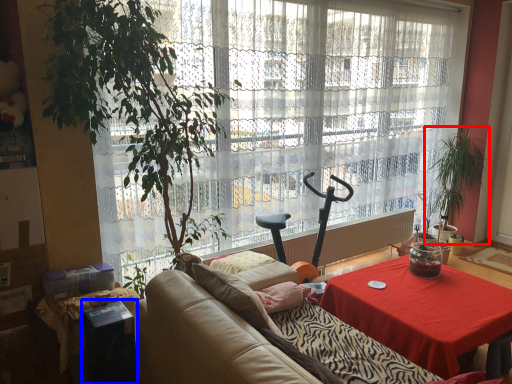
Question: Which point is further to the camera, houseplant (highlighted by a red box) or cocktail table (highlighted by a blue box)?

Choices:
 (A) houseplant
 (B) cocktail table

Answer: (A)